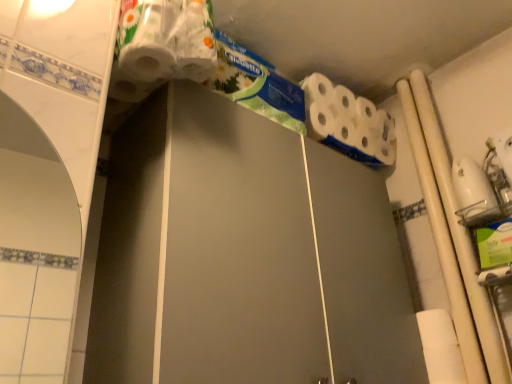
Question: Considering the positions of white matte toilet paper at upper right and green floral toothpaste at upper center in the image, is white matte toilet paper at upper right bigger or smaller than green floral toothpaste at upper center?

Choices:
 (A) small
 (B) big

Answer: (B)

Question: In terms of height, does white matte toilet paper at upper right look taller or shorter compared to green floral toothpaste at upper center?

Choices:
 (A) short
 (B) tall

Answer: (B)

Question: From a real-world perspective, is white matte toilet paper at upper right positioned above or below green floral toothpaste at upper center?

Choices:
 (A) above
 (B) below

Answer: (A)

Question: Relative to white matte toilet paper at upper right, is green floral toothpaste at upper center in front or behind?

Choices:
 (A) front
 (B) behind

Answer: (A)

Question: Is point tap(245, 99) closer or farther from the camera than point tap(339, 142)?

Choices:
 (A) closer
 (B) farther

Answer: (A)

Question: Choose the correct answer: Is green floral toothpaste at upper center inside white matte toilet paper at upper right or outside it?

Choices:
 (A) outside
 (B) inside

Answer: (A)

Question: Looking at their shapes, would you say green floral toothpaste at upper center is wider or thinner than white matte toilet paper at upper right?

Choices:
 (A) thin
 (B) wide

Answer: (A)